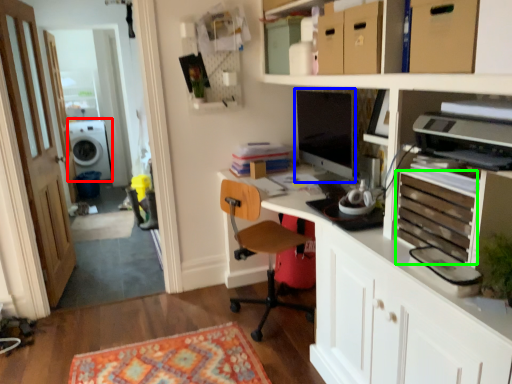
Question: Considering the real-world distances, which object is closest to washing machine (highlighted by a red box)? computer monitor (highlighted by a blue box) or drawer (highlighted by a green box).

Choices:
 (A) computer monitor
 (B) drawer

Answer: (A)